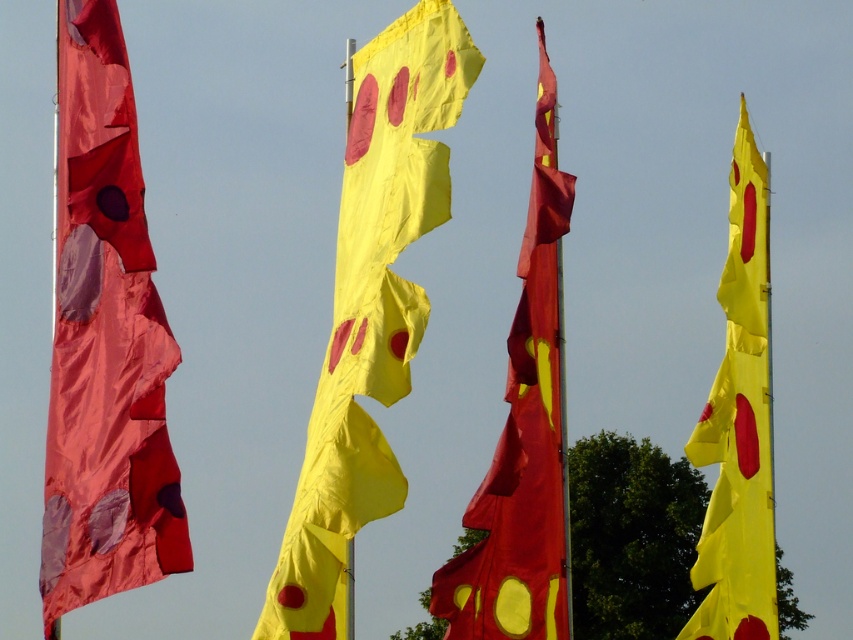
Question: Which of the following is the farthest from the observer?

Choices:
 (A) yellow fabric flag at center
 (B) yellow matte fabric flag at center
 (C) matte red fabric flag at left

Answer: (B)

Question: Which of these objects is positioned closest to the yellow fabric flag at right?

Choices:
 (A) yellow fabric flag at center
 (B) matte red fabric flag at left

Answer: (A)

Question: Can you confirm if matte red fabric flag at left is positioned below yellow matte fabric flag at center?

Choices:
 (A) no
 (B) yes

Answer: (B)

Question: Considering the relative positions of matte red fabric flag at left and yellow fabric flag at right in the image provided, where is matte red fabric flag at left located with respect to yellow fabric flag at right?

Choices:
 (A) right
 (B) left

Answer: (B)

Question: In this image, where is matte red fabric flag at left located relative to yellow fabric flag at center?

Choices:
 (A) left
 (B) right

Answer: (A)

Question: Estimate the real-world distances between objects in this image. Which object is closer to the matte red fabric flag at left?

Choices:
 (A) yellow fabric flag at right
 (B) yellow fabric flag at center

Answer: (B)